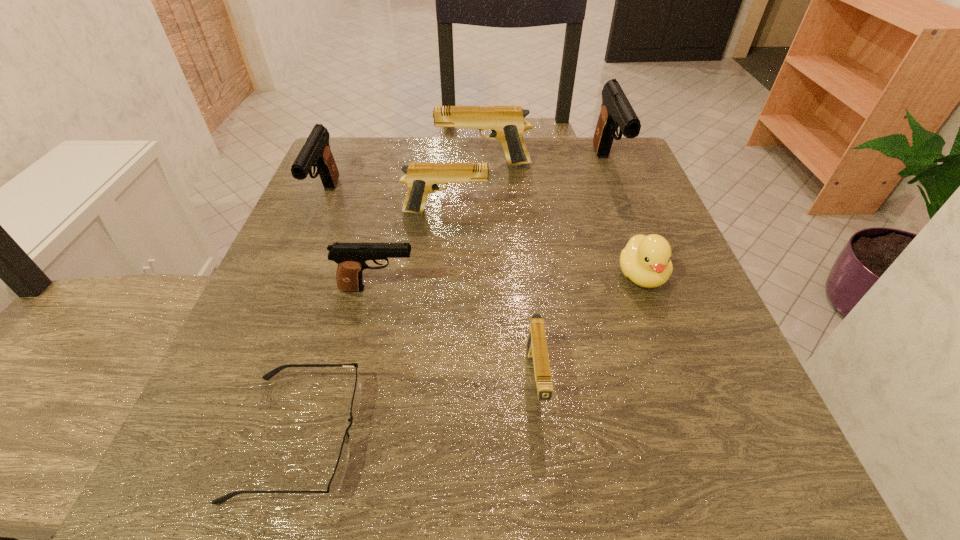
This screenshot has height=540, width=960. I want to click on vacant space at the far edge of the desktop, so click(x=464, y=185).

The width and height of the screenshot is (960, 540). In the image, there is a desktop. In order to click on vacant area at the near edge in this screenshot , I will do `click(609, 484)`.

In the image, there is a desktop. At what (x,y) coordinates should I click in order to perform the action: click on vacant region at the left edge. Please return your answer as a coordinate pair (x, y). The image size is (960, 540). Looking at the image, I should click on click(x=341, y=237).

Find the location of a particular element. This screenshot has width=960, height=540. free spot at the right edge of the desktop is located at coordinates (670, 231).

Find the location of a particular element. vacant space at the far left corner of the desktop is located at coordinates (355, 191).

Find the location of `free space at the far right corner`. free space at the far right corner is located at coordinates (625, 164).

In the image, there is a desktop. Where is `vacant space at the near right corner`? Image resolution: width=960 pixels, height=540 pixels. vacant space at the near right corner is located at coordinates (706, 462).

At what (x,y) coordinates should I click in order to perform the action: click on free area in between the second biggest tan pistol and the duckling. Please return your answer as a coordinate pair (x, y). The image size is (960, 540). Looking at the image, I should click on (543, 244).

The height and width of the screenshot is (540, 960). In order to click on free space between the smallest tan pistol and the farthest tan pistol in this screenshot , I will do `click(510, 273)`.

Where is `vacant region between the leftmost pistol and the duckling`? This screenshot has width=960, height=540. vacant region between the leftmost pistol and the duckling is located at coordinates (484, 237).